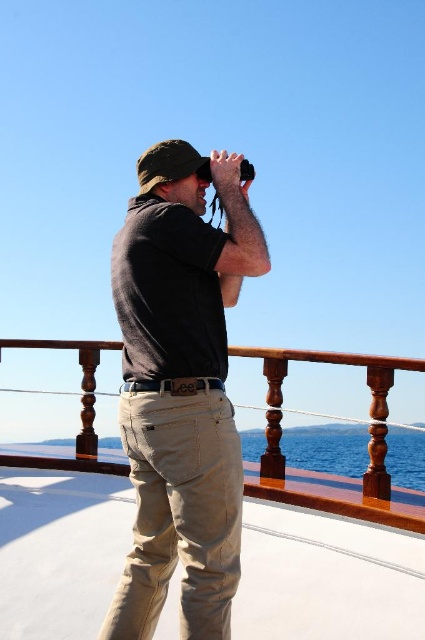
Question: Does dark gray cotton shirt at center have a greater width compared to wooden at center?

Choices:
 (A) no
 (B) yes

Answer: (A)

Question: Among these points, which one is farthest from the camera?

Choices:
 (A) (317, 499)
 (B) (215, 369)

Answer: (A)

Question: Does dark gray cotton shirt at center appear on the right side of wooden at center?

Choices:
 (A) no
 (B) yes

Answer: (A)

Question: In this image, where is dark gray cotton shirt at center located relative to wooden at center?

Choices:
 (A) below
 (B) above

Answer: (B)

Question: Which object is closer to the camera taking this photo?

Choices:
 (A) wooden at center
 (B) dark gray cotton shirt at center

Answer: (B)